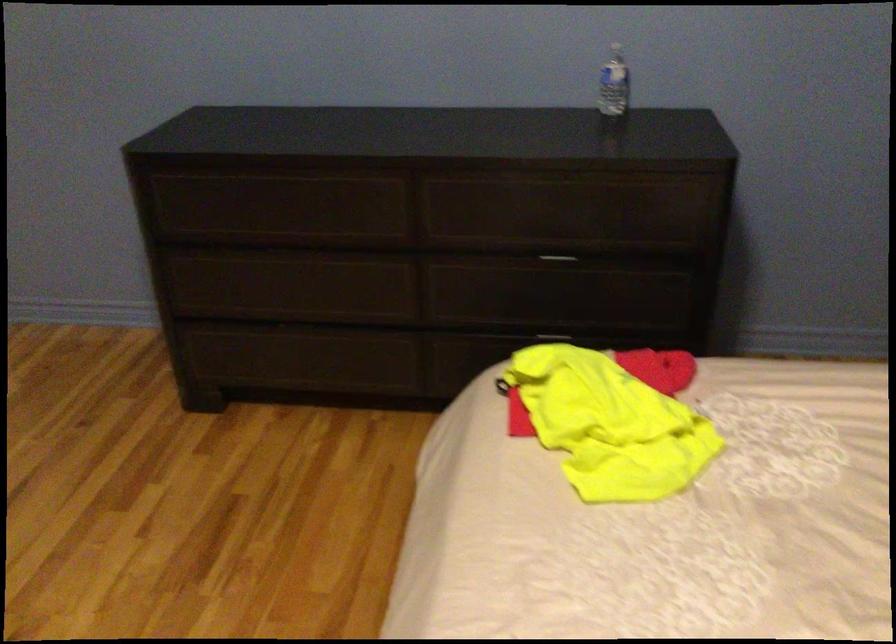
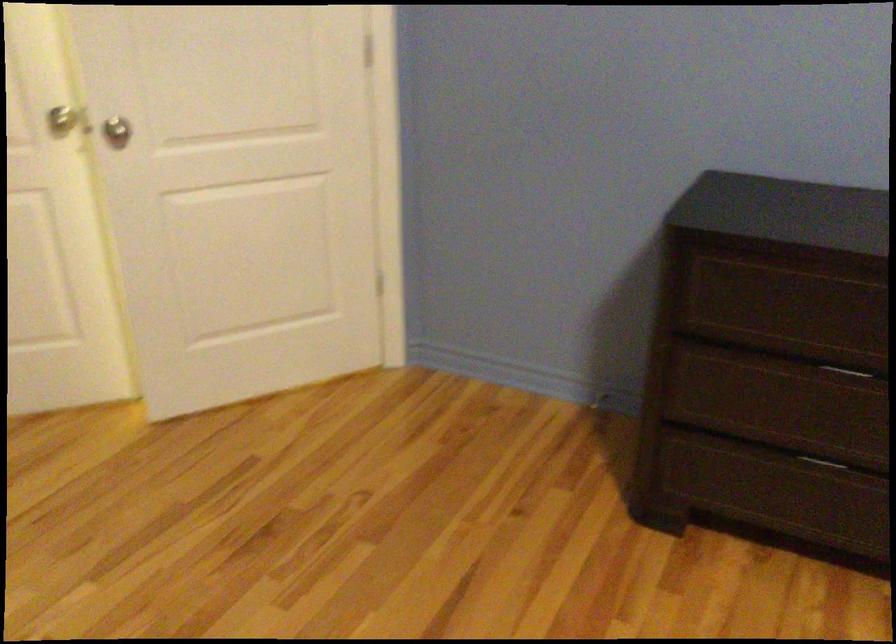
Where in the second image is the point corresponding to [289,328] from the first image?

(821, 462)